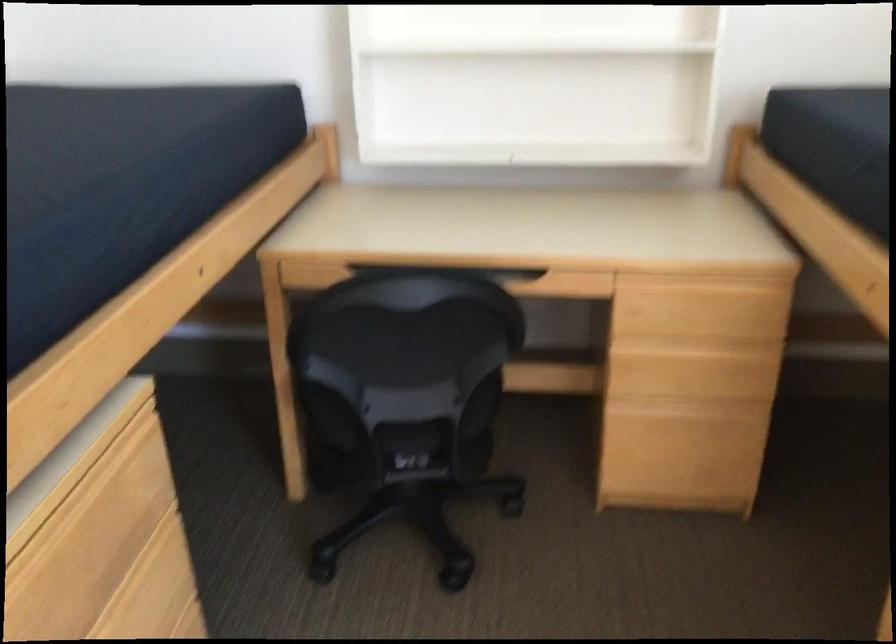
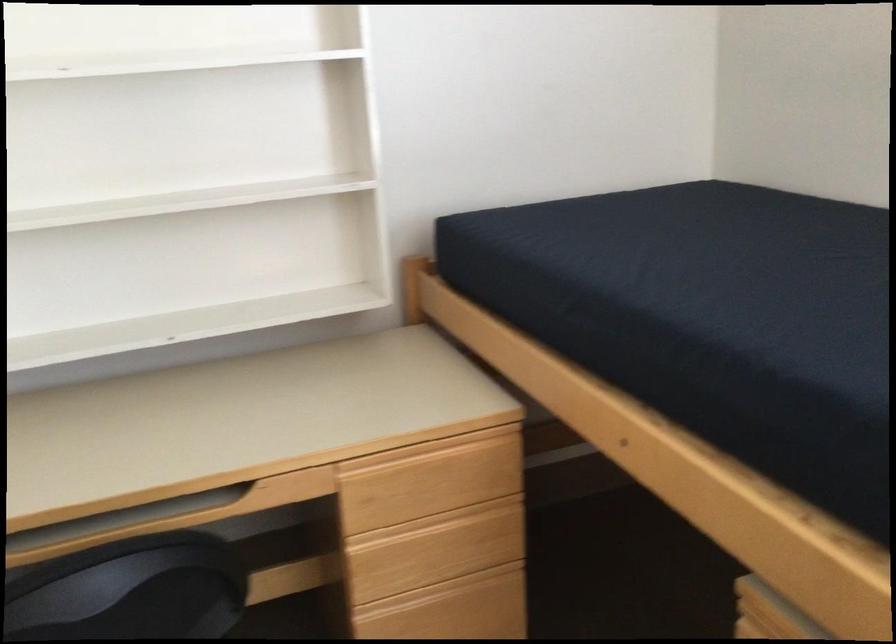
Locate, in the second image, the point that corresponds to point 685,275 in the first image.

(417, 451)